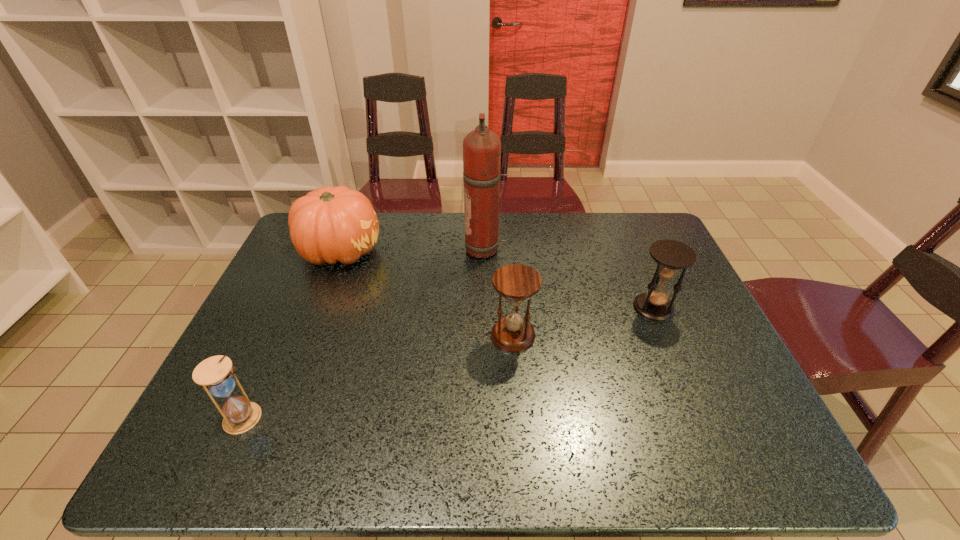
Identify the location of object at the near left corner. (215, 374).

Locate an element on the screen. This screenshot has height=540, width=960. vacant region at the far edge of the desktop is located at coordinates (377, 213).

In the image, there is a desktop. Where is `vacant space at the near edge`? vacant space at the near edge is located at coordinates (464, 440).

At what (x,y) coordinates should I click in order to perform the action: click on vacant point at the left edge. Please return your answer as a coordinate pair (x, y). This screenshot has height=540, width=960. Looking at the image, I should click on (267, 356).

Where is `vacant space at the right edge`? vacant space at the right edge is located at coordinates (682, 386).

In the image, there is a desktop. At what (x,y) coordinates should I click in order to perform the action: click on free region at the near left corner. Please return your answer as a coordinate pair (x, y). The height and width of the screenshot is (540, 960). Looking at the image, I should click on (238, 448).

This screenshot has height=540, width=960. Identify the location of vacant area at the far right corner. (x=635, y=228).

Where is `free space that is in between the second hourglass from right to left and the nearest hourglass`? Image resolution: width=960 pixels, height=540 pixels. free space that is in between the second hourglass from right to left and the nearest hourglass is located at coordinates (379, 377).

Identify the location of blank region between the pumpkin and the nearest object. This screenshot has height=540, width=960. (293, 334).

Locate an element on the screen. This screenshot has height=540, width=960. free point between the tallest object and the nearest hourglass is located at coordinates (365, 334).